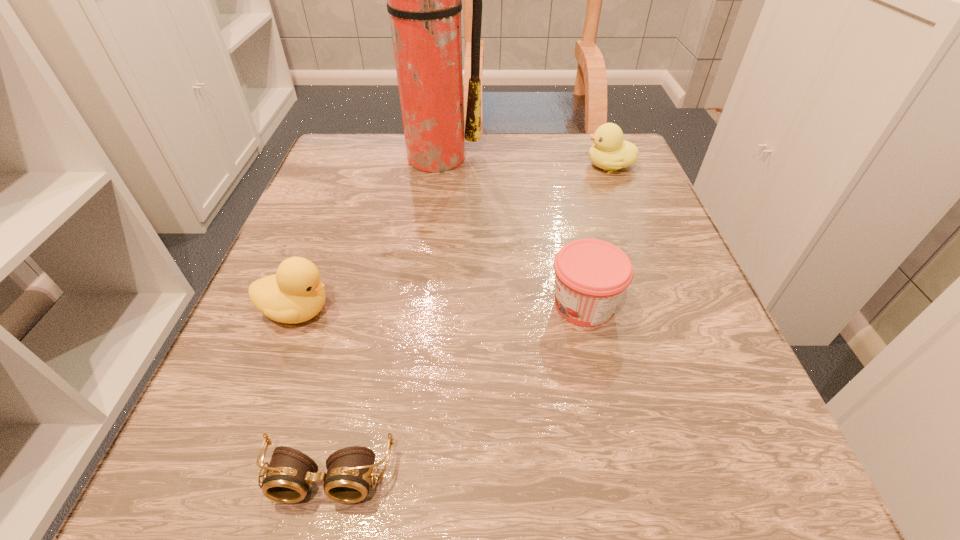
Find the location of a particular element. The width and height of the screenshot is (960, 540). free spot between the duck and the duckling is located at coordinates (453, 238).

Identify the location of free point between the jam and the duckling. (597, 235).

Find the location of a particular element. The height and width of the screenshot is (540, 960). the third closest object to the goggles is located at coordinates (424, 0).

Select which object is the closest to the duckling. Please provide its 2D coordinates. Your answer should be formatted as a tuple, i.e. [(x, y)], where the tuple contains the x and y coordinates of a point satisfying the conditions above.

[(424, 0)]

Find the location of a particular element. vacant space that satisfies the following two spatial constraints: 1. at the beak of the duckling; 2. through the lenses of the goggles is located at coordinates (731, 476).

I want to click on vacant space that satisfies the following two spatial constraints: 1. at the beak of the duckling; 2. through the lenses of the shortest object, so click(x=731, y=476).

Identify the location of free space in the image that satisfies the following two spatial constraints: 1. on the front label of the second object from right to left; 2. through the lenses of the goggles. (622, 476).